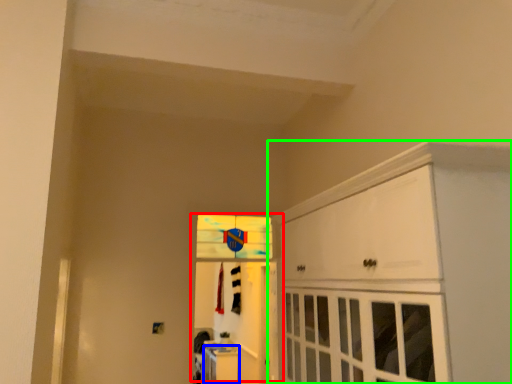
Question: Considering the real-world distances, which object is farthest from door (highlighted by a red box)? cabinetry (highlighted by a blue box) or cabinetry (highlighted by a green box)?

Choices:
 (A) cabinetry
 (B) cabinetry

Answer: (B)